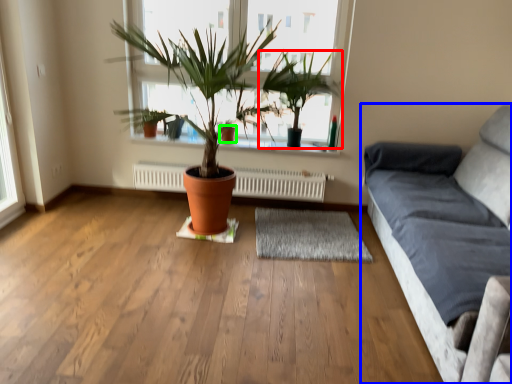
Question: Which object is positioned closest to houseplant (highlighted by a red box)? Select from studio couch (highlighted by a blue box) and flowerpot (highlighted by a green box).

Choices:
 (A) studio couch
 (B) flowerpot

Answer: (B)